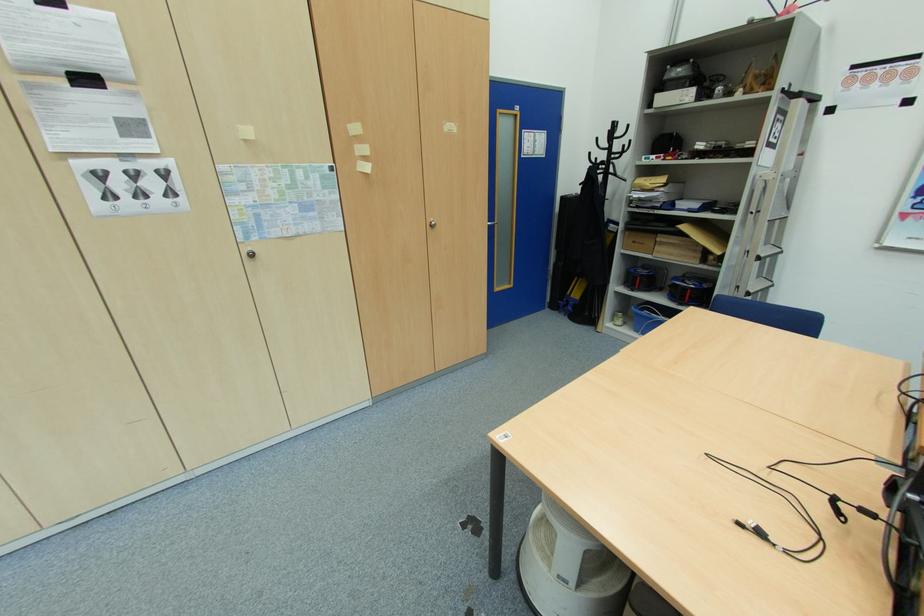
Where is `silver door handle`? silver door handle is located at coordinates (493, 224).